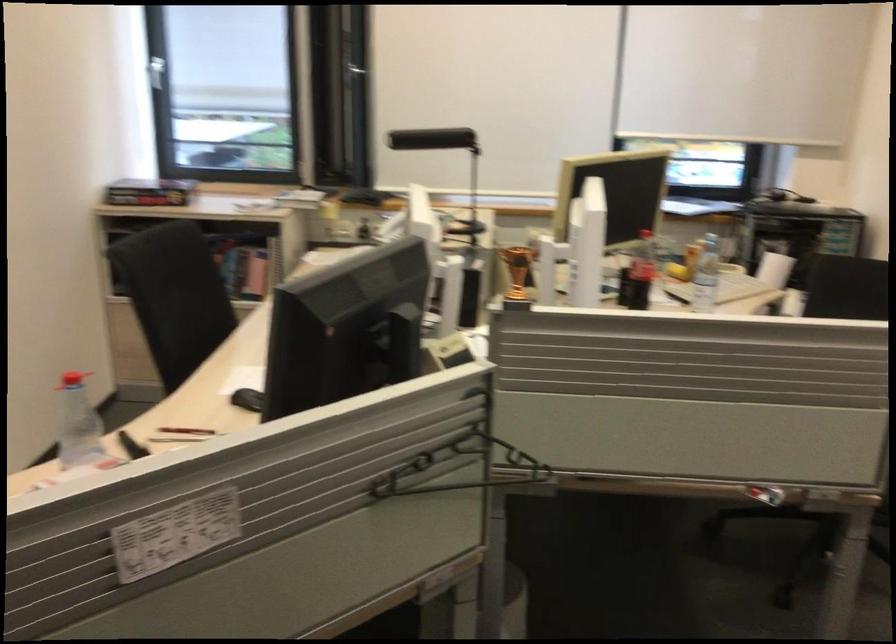
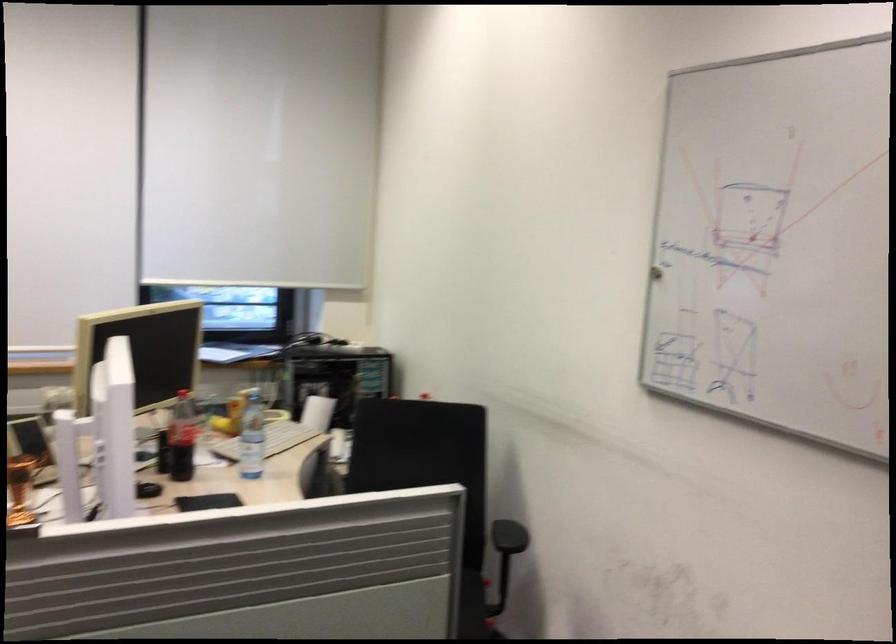
Question: The camera is either moving clockwise (left) or counter-clockwise (right) around the object. The first image is from the beginning of the video and the second image is from the end. Is the camera moving left or right when shooting the video?

Choices:
 (A) Left
 (B) Right

Answer: (A)